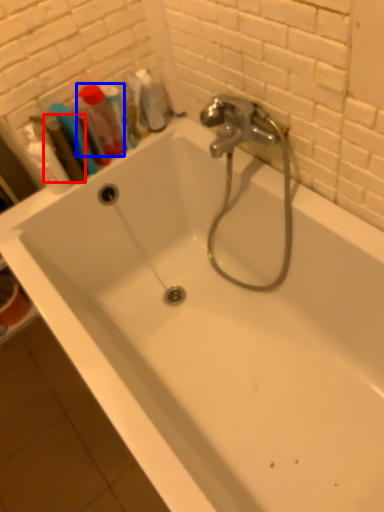
Question: Which object is closer to the camera taking this photo, mouthwash (highlighted by a red box) or mouthwash (highlighted by a blue box)?

Choices:
 (A) mouthwash
 (B) mouthwash

Answer: (A)